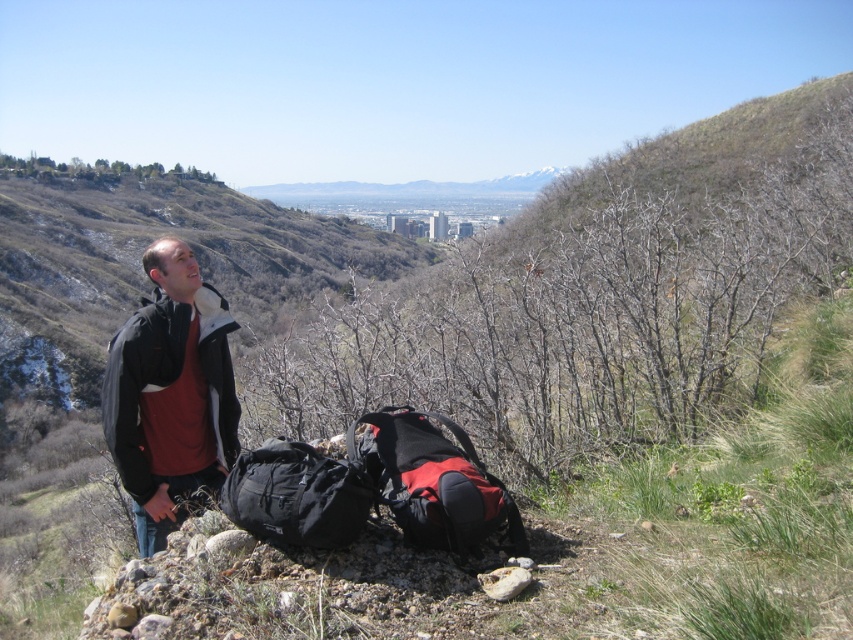
In the scene shown: Is dark gray fleece jacket at center shorter than black fabric backpack at center?

Incorrect, dark gray fleece jacket at center's height does not fall short of black fabric backpack at center's.

Is dark gray fleece jacket at center positioned before black fabric backpack at center?

No.

Find the location of a particular element. This screenshot has width=853, height=640. dark gray fleece jacket at center is located at coordinates (170, 392).

Who is lower down, gray rock at lower center or smooth gray rock at lower left?

smooth gray rock at lower left is below.

At what (x,y) coordinates should I click in order to perform the action: click on gray rock at lower center. Please return your answer as a coordinate pair (x, y). Looking at the image, I should click on (229, 541).

Can you confirm if dark gray fleece jacket at center is smaller than gray rock at lower center?

Actually, dark gray fleece jacket at center might be larger than gray rock at lower center.

Is dark gray fleece jacket at center to the left of gray rock at lower center from the viewer's perspective?

Indeed, dark gray fleece jacket at center is positioned on the left side of gray rock at lower center.

Is point (137, 358) more distant than point (225, 552)?

Yes, it is.

You are a GUI agent. You are given a task and a screenshot of the screen. Output one action in this format:
    pyautogui.click(x=<x>, y=<y>)
    Task: Click on the dark gray fleece jacket at center
    The width and height of the screenshot is (853, 640).
    Given the screenshot: What is the action you would take?
    pyautogui.click(x=170, y=392)